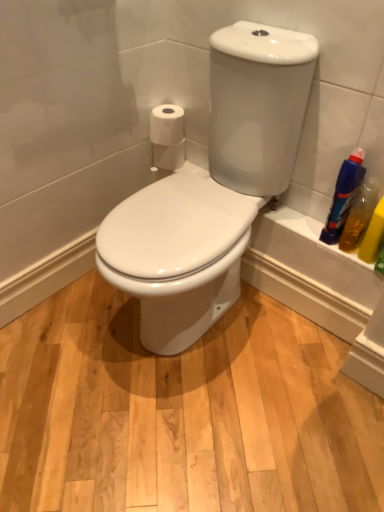
You are a GUI agent. You are given a task and a screenshot of the screen. Output one action in this format:
    pyautogui.click(x=<x>, y=<y>)
    Task: Click on the vacant space to the left of blue plastic bottle at right, placed as the first cleaning product when sorted from left to right
    
    Given the screenshot: What is the action you would take?
    pyautogui.click(x=298, y=222)